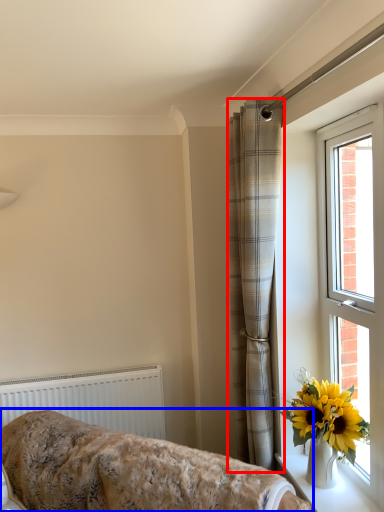
Question: Which object is closer to the camera taking this photo, curtain (highlighted by a red box) or furniture (highlighted by a blue box)?

Choices:
 (A) curtain
 (B) furniture

Answer: (B)